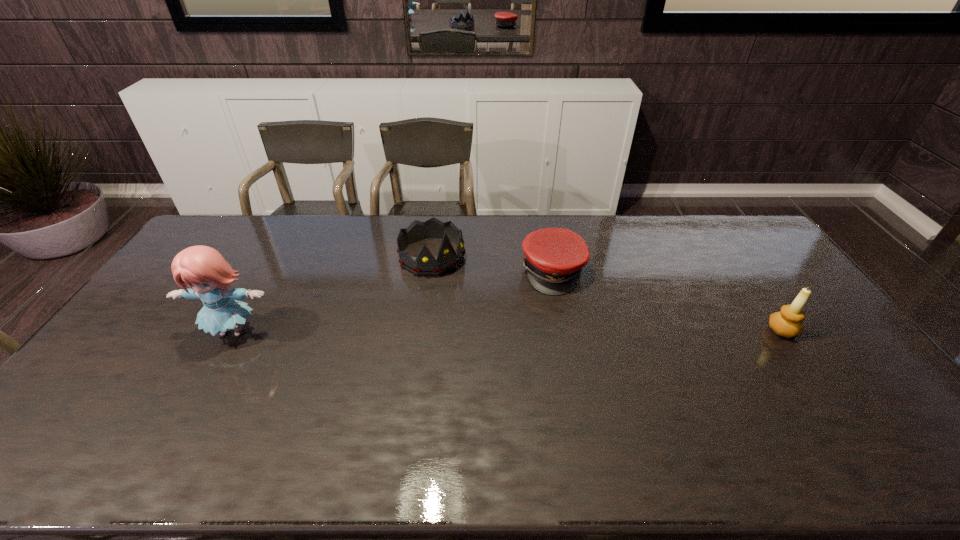
Locate an element on the screen. This screenshot has height=540, width=960. free spot on the desktop that is between the doll and the rightmost object and is positioned at the front of the third object from right to left with jewels is located at coordinates (502, 331).

Image resolution: width=960 pixels, height=540 pixels. In order to click on free spot on the desktop that is between the doll and the candle_holder and is positioned on the front of the second object from right to left with an emblem in this screenshot , I will do `click(583, 330)`.